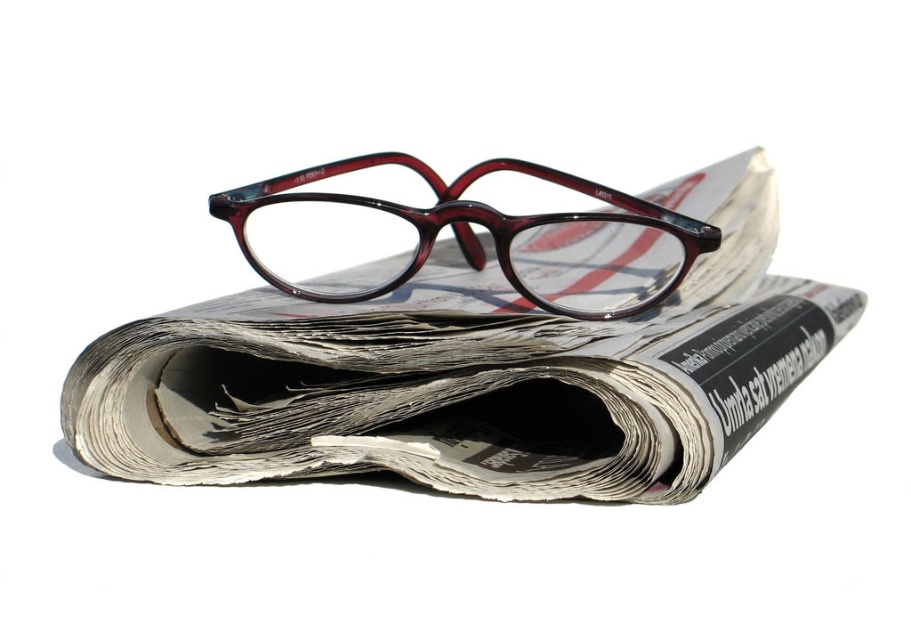
Who is taller, white printed newspaper at center or translucent maroon plastic glasses at center?

white printed newspaper at center

Between white printed newspaper at center and translucent maroon plastic glasses at center, which one appears on the right side from the viewer's perspective?

white printed newspaper at center is more to the right.

Find the location of a particular element. white printed newspaper at center is located at coordinates (469, 374).

At what (x,y) coordinates should I click in order to perform the action: click on white printed newspaper at center. Please return your answer as a coordinate pair (x, y). This screenshot has height=640, width=911. Looking at the image, I should click on (469, 374).